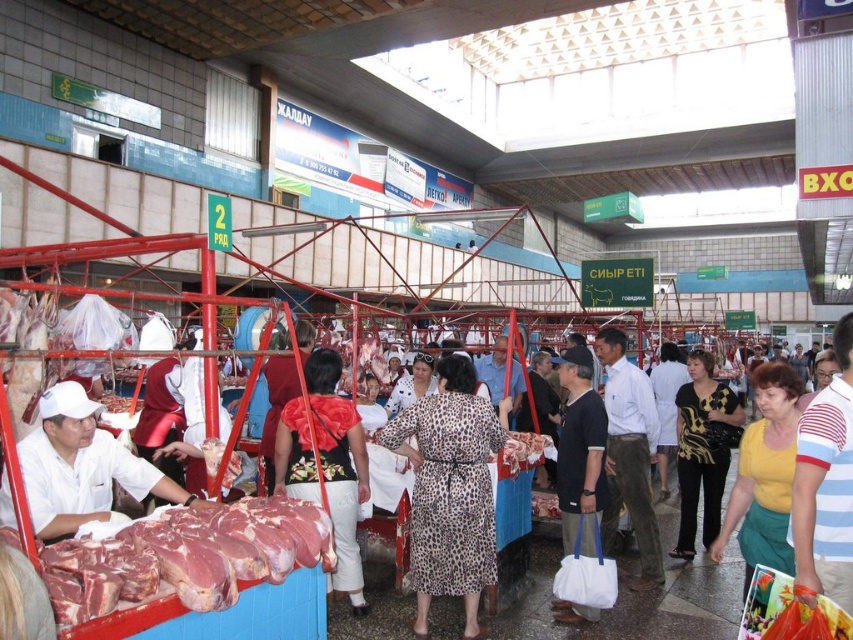
Between striped cotton shirt at center-right and green leafy salad at center, which one is positioned higher?

Positioned higher is striped cotton shirt at center-right.

Can you confirm if striped cotton shirt at center-right is shorter than green leafy salad at center?

In fact, striped cotton shirt at center-right may be taller than green leafy salad at center.

Who is more forward, [840,580] or [321,468]?

Point [840,580] is more forward.

Identify the location of striped cotton shirt at center-right. (825, 484).

Is green leafy salad at center to the left of raw meat at center from the viewer's perspective?

Incorrect, green leafy salad at center is not on the left side of raw meat at center.

Locate an element on the screen. This screenshot has width=853, height=640. green leafy salad at center is located at coordinates (335, 467).

Which is in front, point (299, 474) or point (111, 403)?

Point (299, 474) is more forward.

Identify the location of green leafy salad at center. (335, 467).

Between floral dress at center and raw meat at center, which one appears on the left side from the viewer's perspective?

From the viewer's perspective, raw meat at center appears more on the left side.

Between floral dress at center and raw meat at center, which one has more height?

Standing taller between the two is floral dress at center.

In order to click on floral dress at center in this screenshot , I will do `click(326, 464)`.